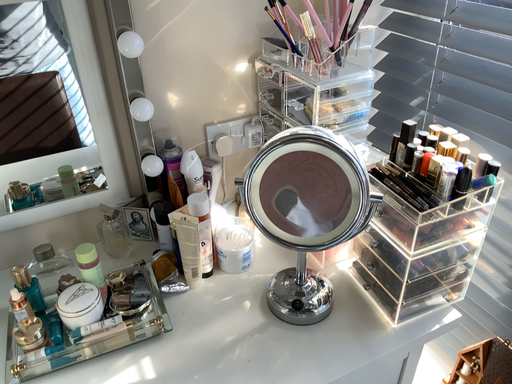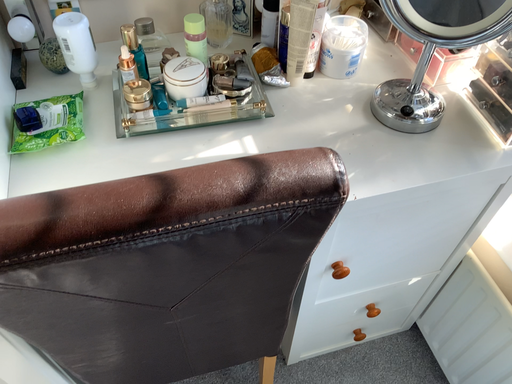
Question: How did the camera likely rotate when shooting the video?

Choices:
 (A) rotated left
 (B) rotated right

Answer: (A)